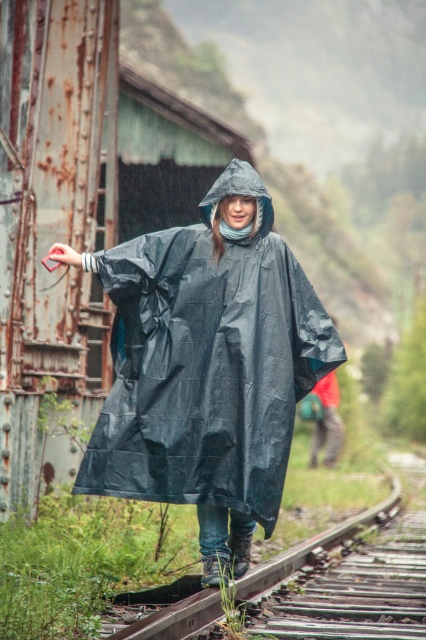
Image resolution: width=426 pixels, height=640 pixels. What do you see at coordinates (345, 580) in the screenshot?
I see `brown wooden track at center` at bounding box center [345, 580].

Can you confirm if brown wooden track at center is taller than red fabric umbrella at center?

No, brown wooden track at center is not taller than red fabric umbrella at center.

This screenshot has height=640, width=426. What do you see at coordinates (345, 580) in the screenshot? I see `brown wooden track at center` at bounding box center [345, 580].

Where is `brown wooden track at center`? brown wooden track at center is located at coordinates (345, 580).

Consider the image. Can you confirm if brown wooden track at center is positioned to the right of black matte raincoat at center?

Correct, you'll find brown wooden track at center to the right of black matte raincoat at center.

Who is taller, brown wooden track at center or black matte raincoat at center?

With more height is brown wooden track at center.

Is point (374, 515) behind point (253, 172)?

Yes, point (374, 515) is farther from viewer.

You are a GUI agent. You are given a task and a screenshot of the screen. Output one action in this format:
    pyautogui.click(x=<x>, y=<y>)
    Task: Click on the brown wooden track at center
    The height and width of the screenshot is (640, 426).
    Given the screenshot: What is the action you would take?
    pyautogui.click(x=345, y=580)

Can you confirm if black plastic poncho at center is bigger than red fabric umbrella at center?

No, black plastic poncho at center is not bigger than red fabric umbrella at center.

Does black plastic poncho at center have a greater height compared to red fabric umbrella at center?

Yes.

Image resolution: width=426 pixels, height=640 pixels. I want to click on black plastic poncho at center, so click(x=207, y=365).